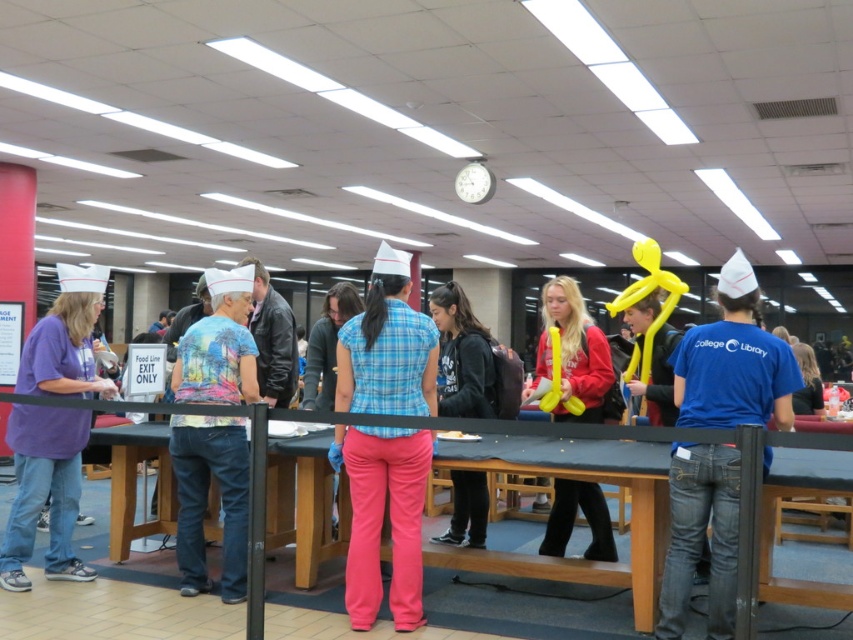
Question: Among these objects, which one is farthest from the camera?

Choices:
 (A) printed cotton shirt at center
 (B) white plastic clock at upper center

Answer: (B)

Question: Which is nearer to the black hoodie at center?

Choices:
 (A) white plastic clock at upper center
 (B) blue cotton shirt at center

Answer: (B)

Question: Among these objects, which one is nearest to the camera?

Choices:
 (A) blue cotton shirt at center
 (B) matte purple shirt at left
 (C) plaid fabric shirt at center
 (D) red matte balloon at center

Answer: (A)

Question: Is matte purple shirt at left to the left of black hoodie at center from the viewer's perspective?

Choices:
 (A) no
 (B) yes

Answer: (B)

Question: Does plaid fabric shirt at center appear over black hoodie at center?

Choices:
 (A) no
 (B) yes

Answer: (A)

Question: Is matte purple shirt at left smaller than red matte balloon at center?

Choices:
 (A) yes
 (B) no

Answer: (B)